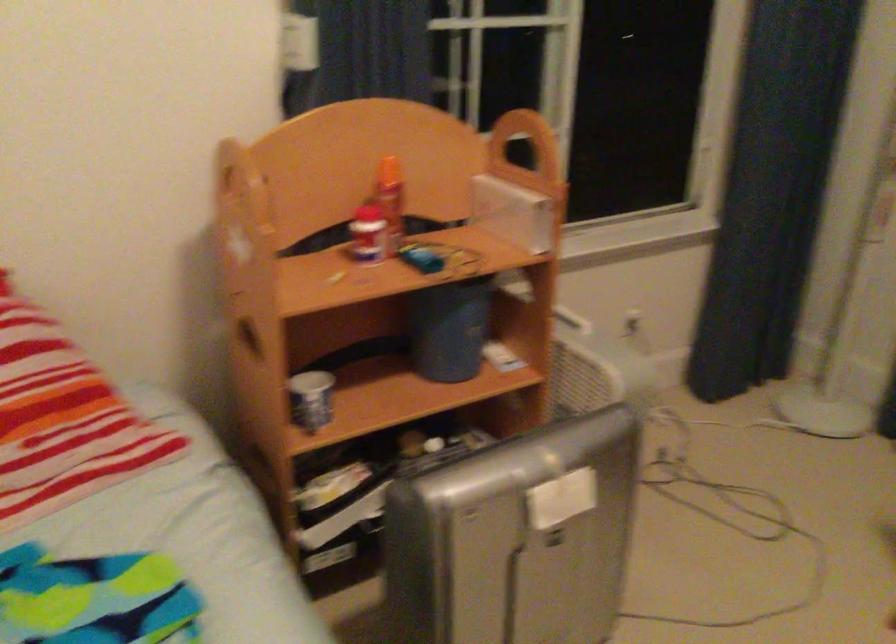
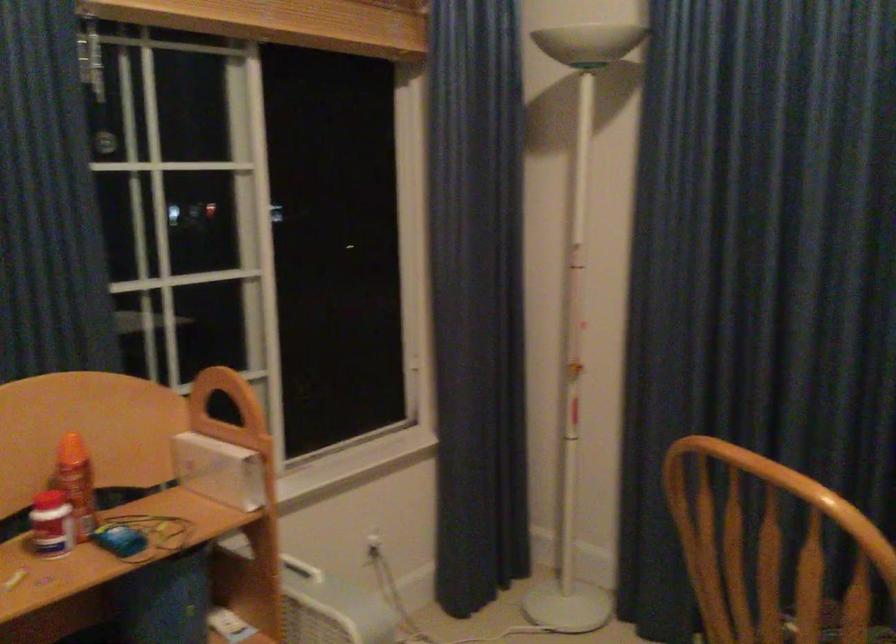
Question: The images are taken continuously from a first-person perspective. In which direction is your viewpoint rotating?

Choices:
 (A) Left
 (B) Right
 (C) Up
 (D) Down

Answer: (B)